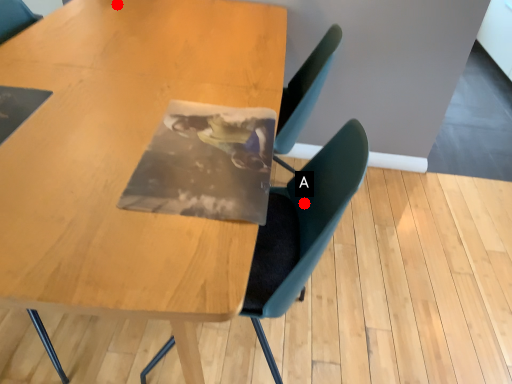
Question: Two points are circled on the image, labeled by A and B beside each circle. Among these points, which one is nearest to the camera?

Choices:
 (A) A is closer
 (B) B is closer

Answer: (A)